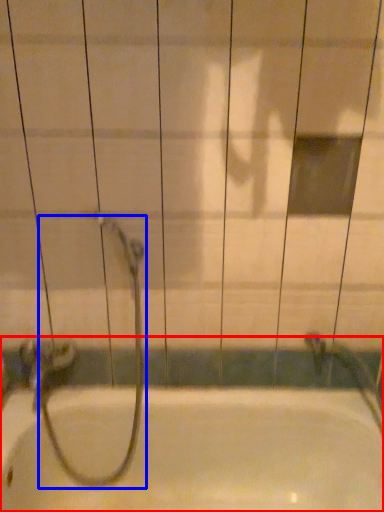
Question: Which point is closer to the camera, bathtub (highlighted by a red box) or garden hose (highlighted by a blue box)?

Choices:
 (A) bathtub
 (B) garden hose

Answer: (A)